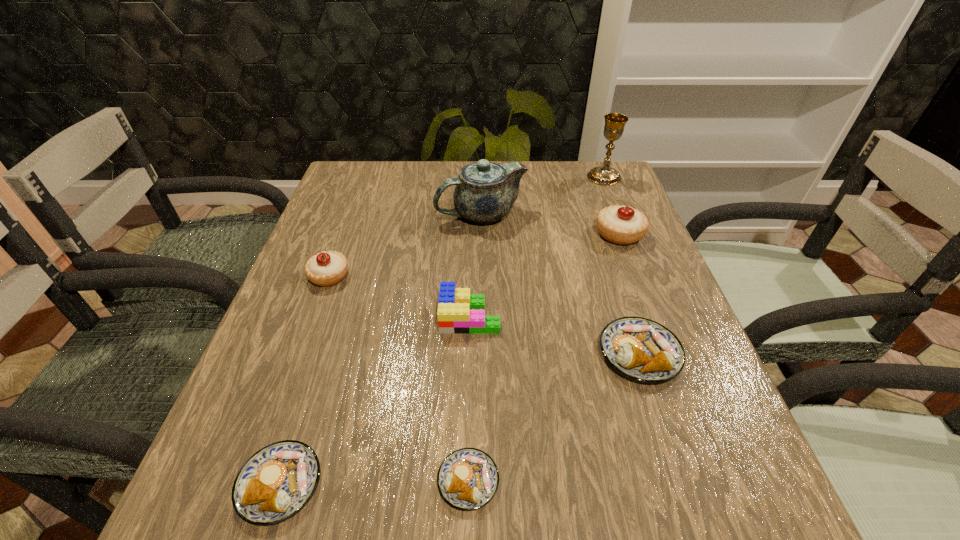
Locate an element on the screen. This screenshot has width=960, height=540. free space that is in between the third nearest pastry and the farthest object is located at coordinates (622, 265).

In order to click on free space that is in between the farther beige pastry and the shortest object in this screenshot , I will do [543, 357].

Where is `free area in between the shortest object and the tallest pastry`? free area in between the shortest object and the tallest pastry is located at coordinates click(x=543, y=357).

Identify the location of object that is the closest to the third pastry from right to left. The image size is (960, 540). (277, 481).

Identify the location of object that ranks as the fifth closest to the third pastry from right to left. (622, 225).

At what (x,y) coordinates should I click in order to perform the action: click on pastry that is the fifth closest to the seventh shortest object. Please return your answer as a coordinate pair (x, y). Image resolution: width=960 pixels, height=540 pixels. Looking at the image, I should click on (277, 481).

At what (x,y) coordinates should I click in order to perform the action: click on pastry that is the third closest to the nearer beige pastry. Please return your answer as a coordinate pair (x, y). This screenshot has width=960, height=540. Looking at the image, I should click on (639, 348).

Locate an element on the screen. The height and width of the screenshot is (540, 960). brown pastry that can be found as the second closest to the fifth nearest object is located at coordinates click(468, 478).

You are a GUI agent. You are given a task and a screenshot of the screen. Output one action in this format:
    pyautogui.click(x=<x>, y=<y>)
    Task: Click on the brown pastry that stands as the third closest to the chinaware
    This screenshot has height=540, width=960.
    Given the screenshot: What is the action you would take?
    pyautogui.click(x=277, y=481)

This screenshot has width=960, height=540. In order to click on free space in the image that satisfies the following two spatial constraints: 1. on the back side of the fourth tallest pastry; 2. on the left side of the biggest brown pastry in this screenshot , I will do `click(322, 353)`.